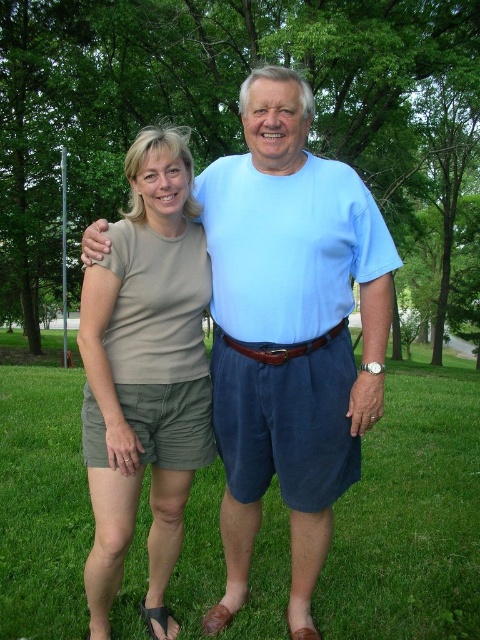
Question: Does green grass at center appear over light blue t-shirt at center?

Choices:
 (A) yes
 (B) no

Answer: (B)

Question: Is light blue t-shirt at center above matte khaki shorts at left?

Choices:
 (A) yes
 (B) no

Answer: (A)

Question: Which point is closer to the camera?

Choices:
 (A) (297, 83)
 (B) (57, 412)

Answer: (A)

Question: Which is nearer to the matte khaki shorts at left?

Choices:
 (A) light blue t-shirt at center
 (B) green grass at center

Answer: (A)

Question: Which point is closer to the camera?

Choices:
 (A) matte khaki shorts at left
 (B) green grass at center

Answer: (A)

Question: In this image, where is light blue t-shirt at center located relative to matte khaki shorts at left?

Choices:
 (A) left
 (B) right

Answer: (B)